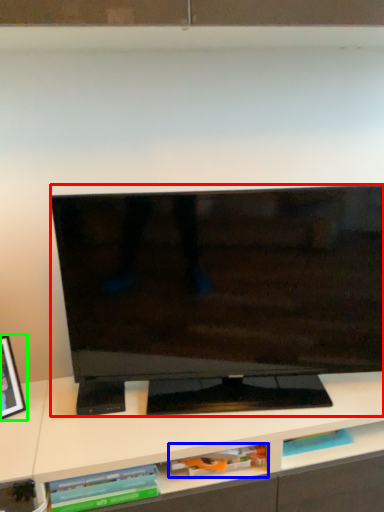
Question: Based on their relative distances, which object is farther from television (highlighted by a red box)? Choose from book (highlighted by a blue box) and picture frame (highlighted by a green box).

Choices:
 (A) book
 (B) picture frame

Answer: (B)